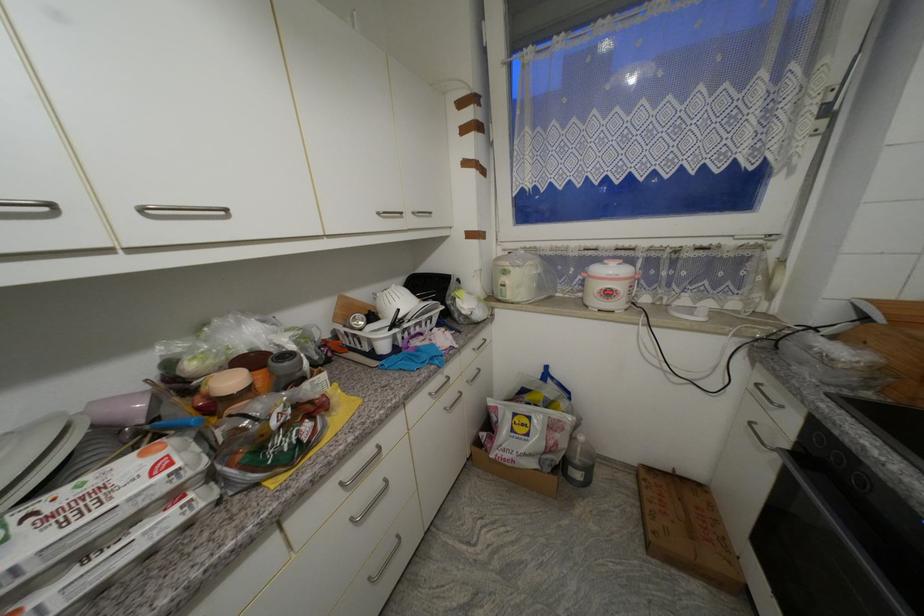
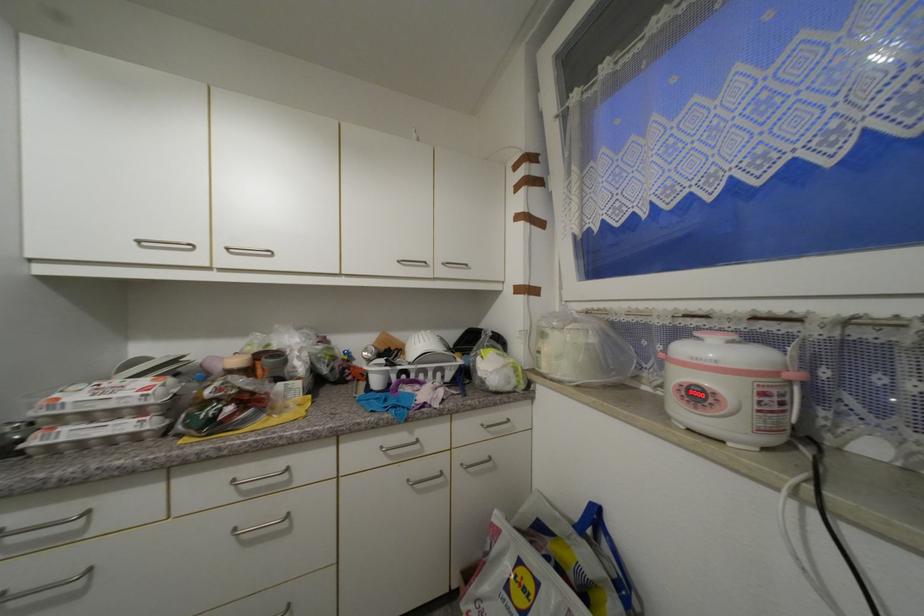
In the second image, find the point that corresponds to point (435, 395) in the first image.

(387, 448)